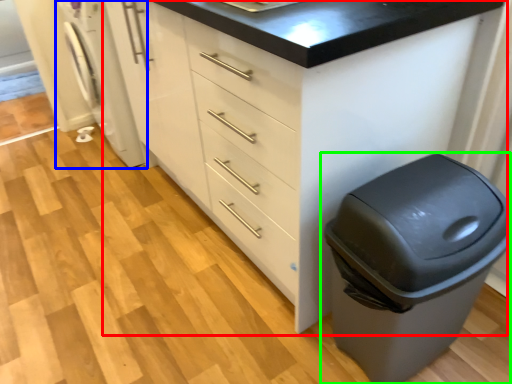
Question: Which is nearer to the chest of drawers (highlighted by a red box)? washing machine (highlighted by a blue box) or waste container (highlighted by a green box).

Choices:
 (A) washing machine
 (B) waste container

Answer: (B)